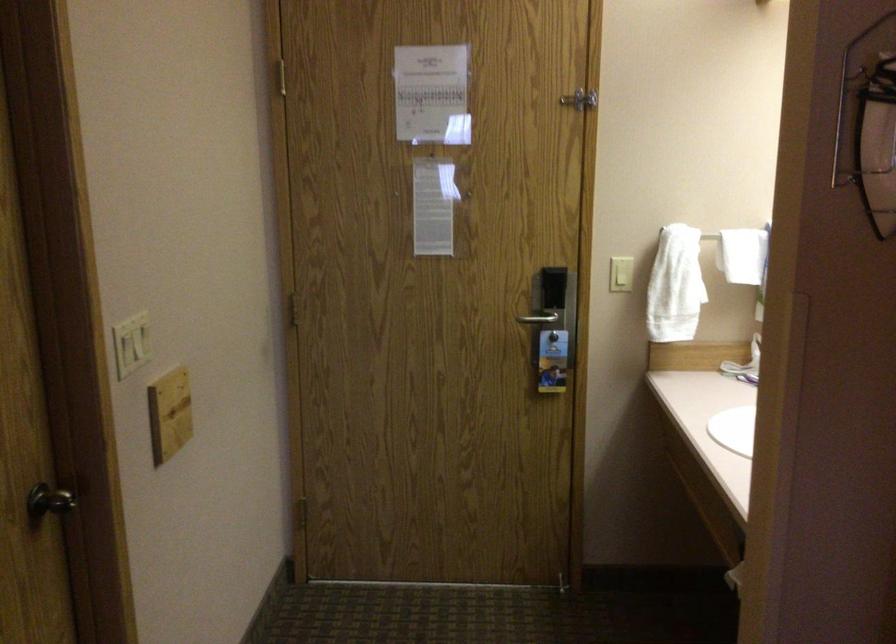
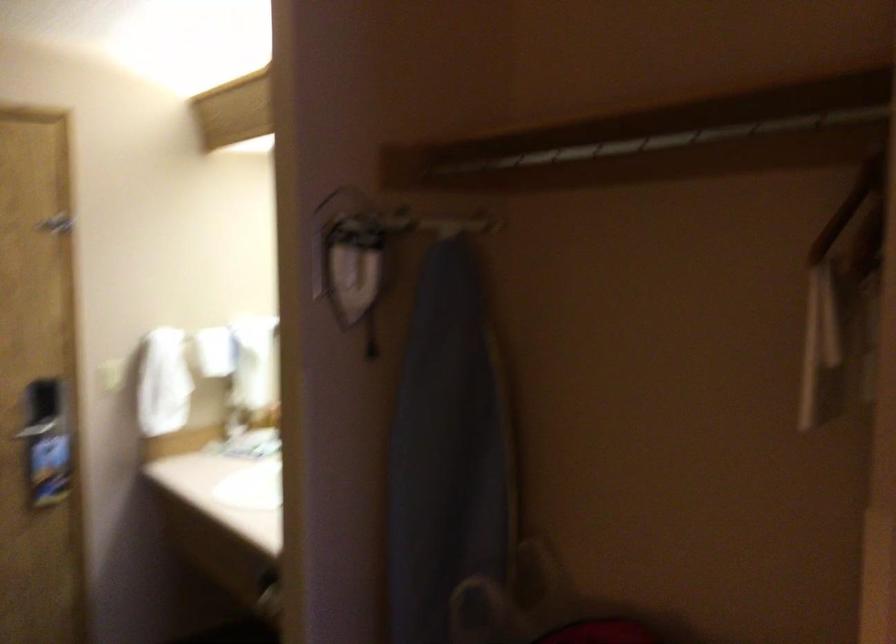
Question: The first image is from the beginning of the video and the second image is from the end. How did the camera likely rotate when shooting the video?

Choices:
 (A) Left
 (B) Right
 (C) Up
 (D) Down

Answer: (B)